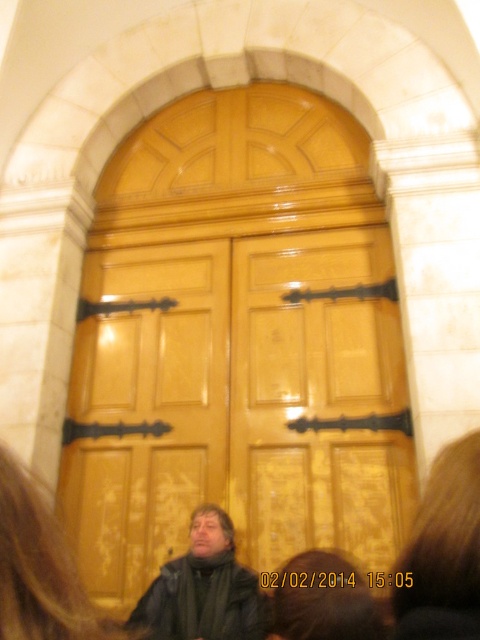
You are a delivery person holding a dark brown leather jacket at center and need to pass through the glossy wood door at center. Can you fit through the doorway with the jacket?

The glossy wood door at center is bigger than the dark brown leather jacket at center, so yes, you can fit through the doorway with the jacket.

You are trying to decide if you can hang your dark brown leather jacket at center on the glossy wood door at center. Based on their sizes, will the jacket fit vertically on the door?

The glossy wood door at center is much taller than the dark brown leather jacket at center, so the jacket will fit vertically on the door.

You are a delivery person holding a dark brown leather jacket at center and need to place it on the glossy wood door at center. Which side of the door should you place the jacket on?

The glossy wood door at center is positioned on the right side of dark brown leather jacket at center, so you should place the jacket on the left side of the door.